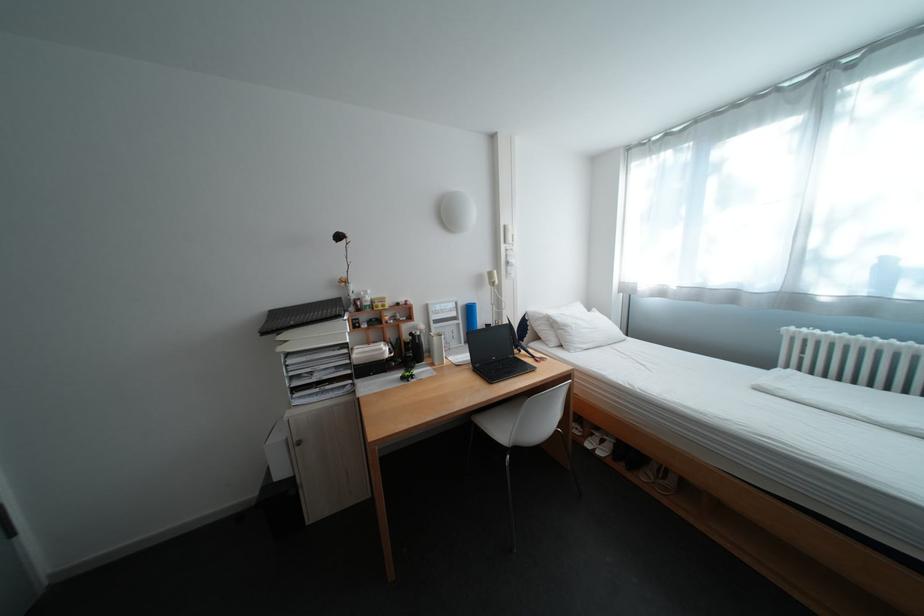
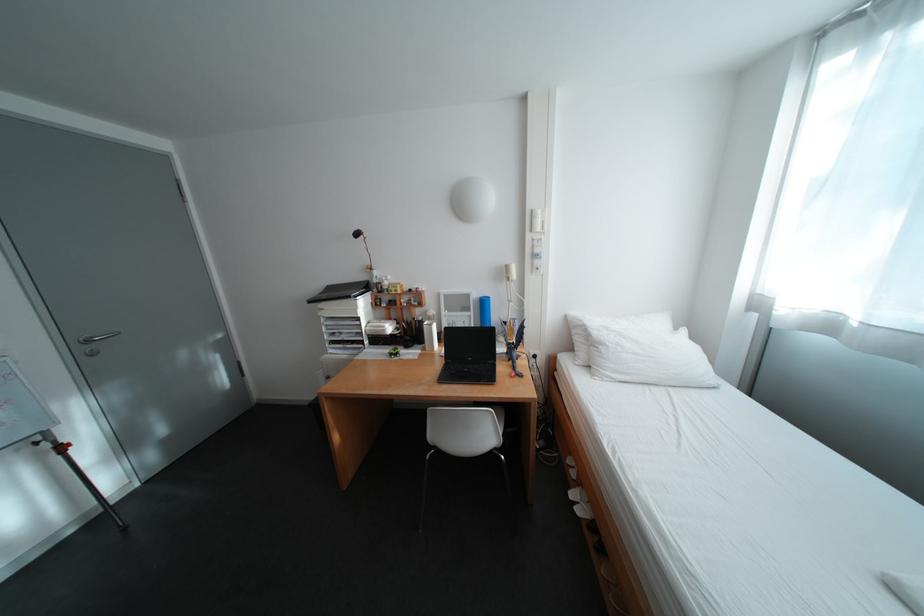
The point at (516,248) is marked in the first image. Where is the corresponding point in the second image?

(541, 237)